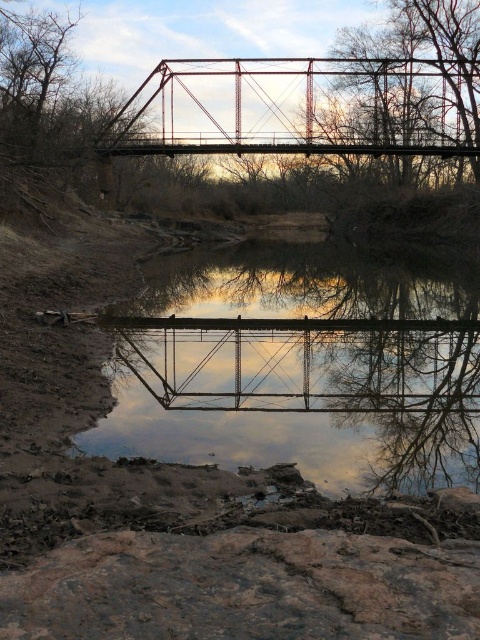
You are standing on the metal truss bridge and looking at the two points marked in the image. Which point, point (203, 388) or point (333, 61), is closer to you?

Point (203, 388) is closer to the camera than point (333, 61).

You are a photographer planning to take a picture of the metallic red bridge at center and the reflective glass water at center. The camera you have can only focus on objects within a 10 meter range. Will both objects be in focus?

The reflective glass water at center and metallic red bridge at center are 13.52 meters apart. Since the camera can only focus within 10 meters, both objects cannot be in focus simultaneously because they are farther apart than the camera can handle.

You are standing on the metal truss bridge and want to take a photo of the reflective glass water at center. Where should you aim your camera to capture the reflection?

You should aim your camera at the point with coordinates (x=301, y=404) to capture the reflective glass water at center.